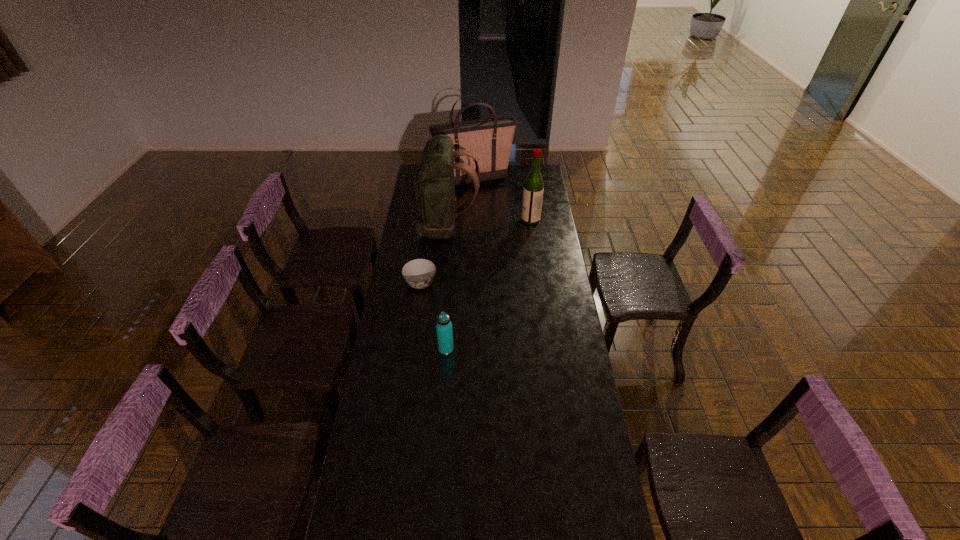
Locate an element on the screen. free space located on the label of the third shortest object is located at coordinates (472, 219).

Locate an element on the screen. The width and height of the screenshot is (960, 540). vacant region located on the label of the third shortest object is located at coordinates (507, 219).

Where is `free space located on the label of the third shortest object`? The width and height of the screenshot is (960, 540). free space located on the label of the third shortest object is located at coordinates (485, 219).

Image resolution: width=960 pixels, height=540 pixels. Find the location of `vacant area located on the left of the water bottle`. vacant area located on the left of the water bottle is located at coordinates (426, 349).

This screenshot has width=960, height=540. I want to click on vacant space located 0.300m on the front of the second nearest object, so click(412, 349).

Locate an element on the screen. The height and width of the screenshot is (540, 960). object situated at the far edge is located at coordinates (489, 140).

Where is `shopping bag located at the left edge`? The width and height of the screenshot is (960, 540). shopping bag located at the left edge is located at coordinates coord(489,140).

Locate an element on the screen. The height and width of the screenshot is (540, 960). backpack that is at the left edge is located at coordinates (434, 187).

Locate an element on the screen. The width and height of the screenshot is (960, 540). soup bowl that is positioned at the left edge is located at coordinates (419, 273).

In order to click on object present at the right edge in this screenshot , I will do `click(533, 189)`.